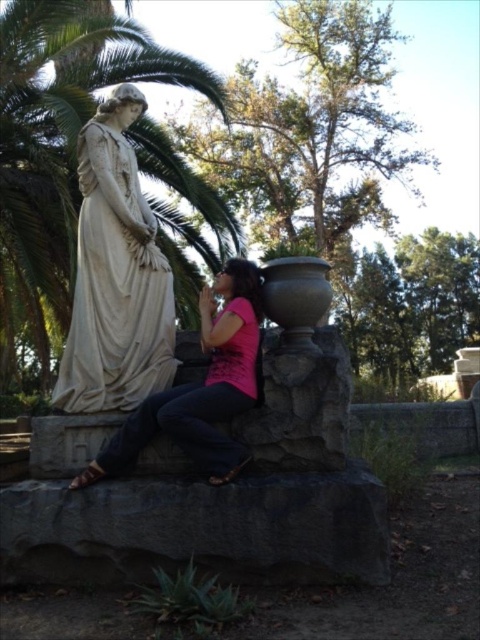
You are standing in the outdoor area and want to take a photo of the white marble statue at left without the green leafy palm tree at upper left blocking the view. Which direction should you move to ensure the statue is visible without the tree obstructing it?

Move away from the green leafy palm tree at upper left so that the statue is between you and the tree. Since the tree is closer to you than the statue, moving away from the tree would place the statue further away from the tree, reducing the chance of obstruction.

You are planning to take a photo of the white marble statue at left and the green leafy palm tree at upper left. Which object should you focus on first if you want to capture both in the same frame without moving the camera?

The green leafy palm tree at upper left has a lesser width compared to the white marble statue at left, so you should focus on the wider white marble statue at left first to ensure both fit in the frame.

You are planning to take a photo of the matte white statue at left and the green leafy palm tree at upper left. Which object should you zoom in more on to ensure both are visible in the frame?

You should zoom in more on the green leafy palm tree at upper left because its width is smaller than the matte white statue at left, so it requires closer focus to be visible alongside the statue.